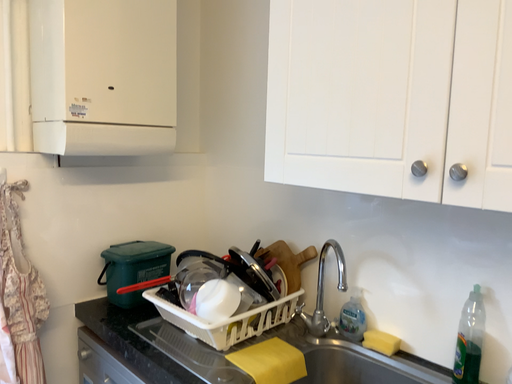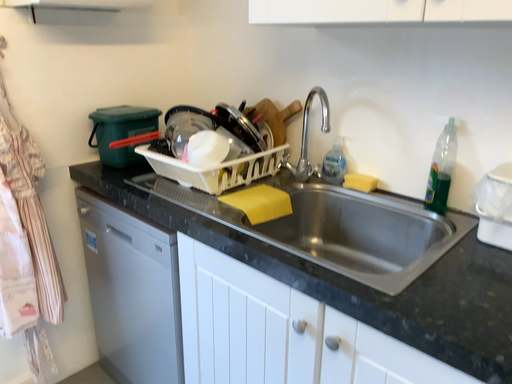
Question: Which way did the camera rotate in the video?

Choices:
 (A) rotated upward
 (B) rotated downward

Answer: (B)